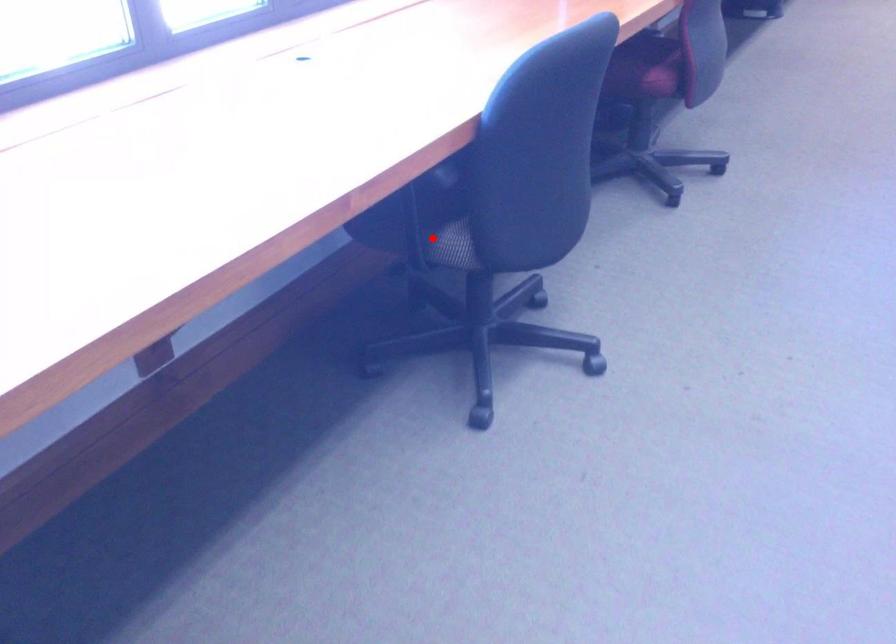
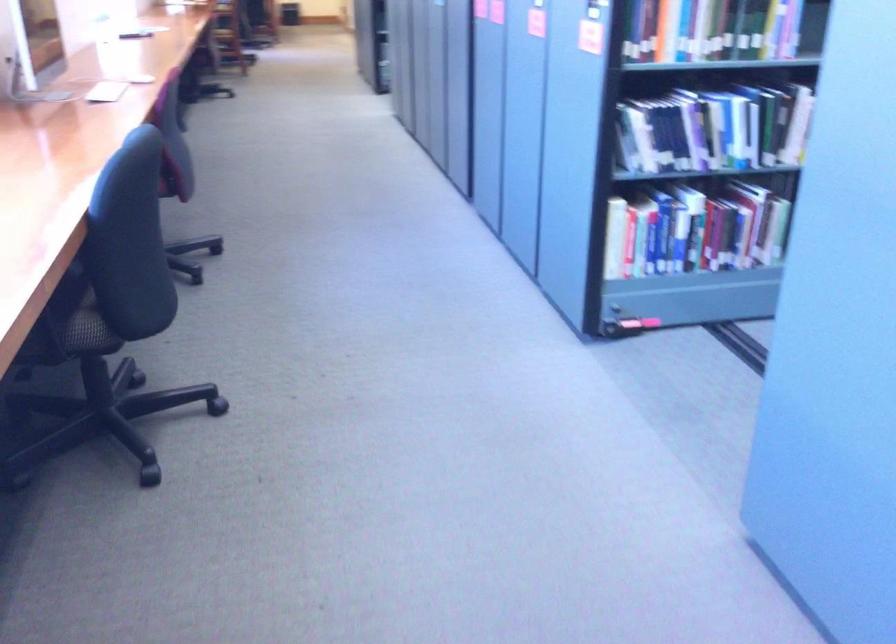
Question: I am providing you with two images of the same scene from different viewpoints. A red point is shown in image1. For the corresponding object point in image2, is it positioned nearer or farther from the camera?

Choices:
 (A) Nearer
 (B) Farther

Answer: (B)